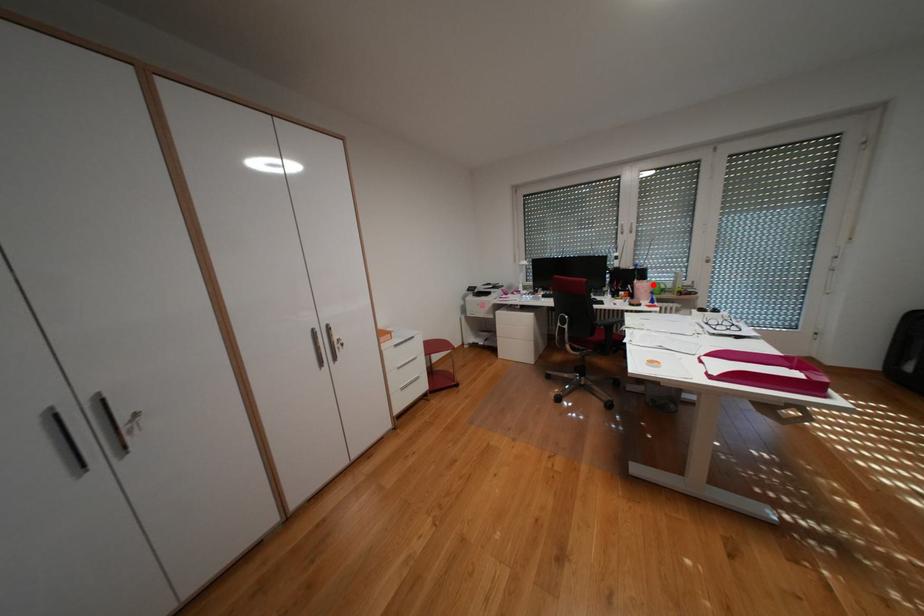
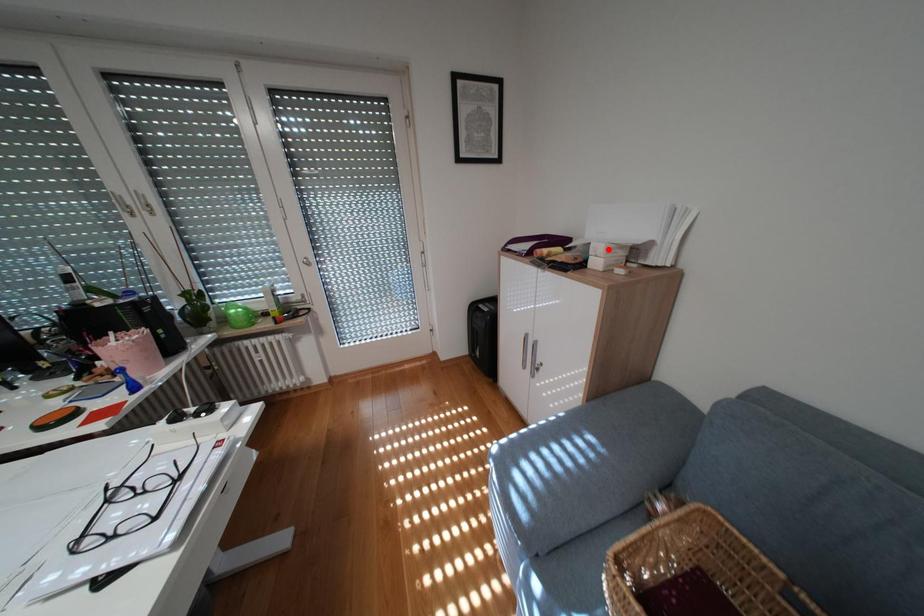
I am providing you with two images of the same scene from different viewpoints. A red point is marked on the first image and another point is marked on the second image. Is the red point in image1 aligned with the point shown in image2?

No